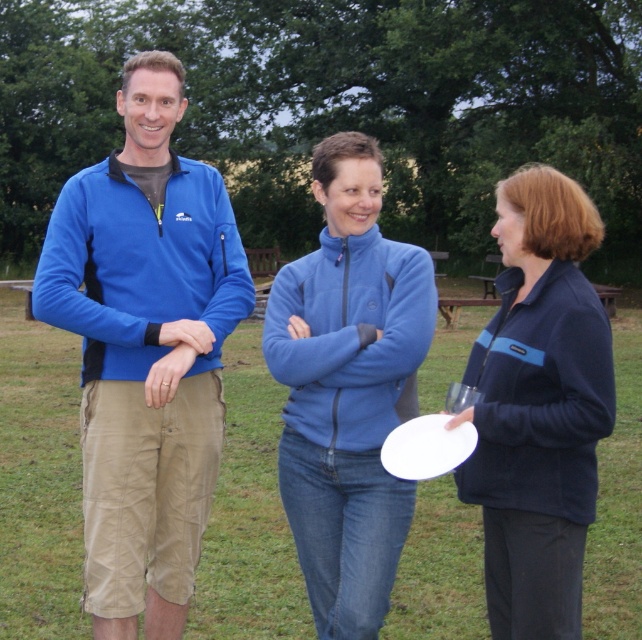
Which is more to the left, matte blue fleece at center or white plastic frisbee at center?

From the viewer's perspective, matte blue fleece at center appears more on the left side.

Between point (213, 461) and point (471, 435), which one is positioned in front?

Positioned in front is point (471, 435).

You are a GUI agent. You are given a task and a screenshot of the screen. Output one action in this format:
    pyautogui.click(x=<x>, y=<y>)
    Task: Click on the matte blue fleece at center
    This screenshot has height=640, width=642.
    Given the screenshot: What is the action you would take?
    pyautogui.click(x=144, y=349)

Is point (321, 314) behind point (550, 436)?

Yes, point (321, 314) is farther from viewer.

Can you confirm if fleece jacket at center is bigger than navy blue fleece at center?

No.

Where is `fleece jacket at center`? The width and height of the screenshot is (642, 640). fleece jacket at center is located at coordinates (347, 388).

Does matte blue fleece at center lie in front of navy blue fleece at center?

No, matte blue fleece at center is further to the viewer.

Between point (150, 324) and point (519, 445), which one is positioned in front?

Point (519, 445) is more forward.

Locate an element on the screen. This screenshot has height=640, width=642. matte blue fleece at center is located at coordinates (144, 349).